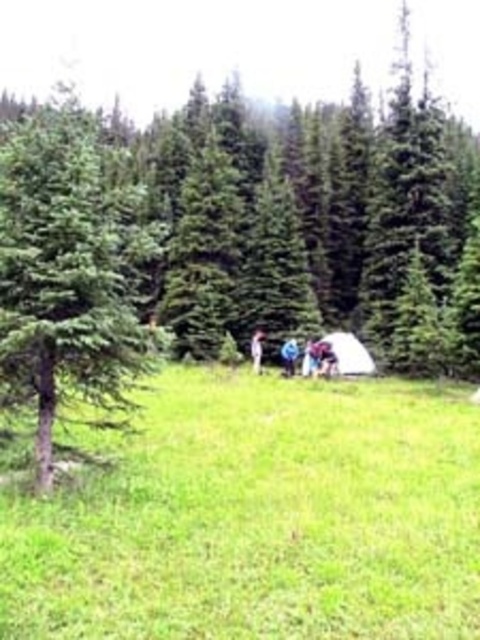
You are standing in the forest scene and see the blue fabric at center. Can you estimate its location using the coordinate system where the bottom left corner is 0,0 and the top right corner is 1,1?

The blue fabric at center is located at coordinate point [289,355].